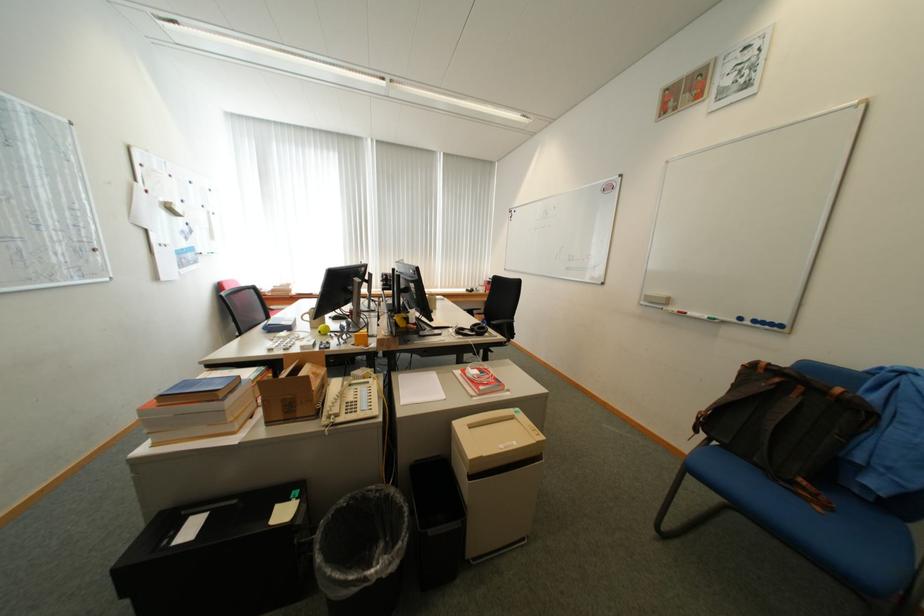
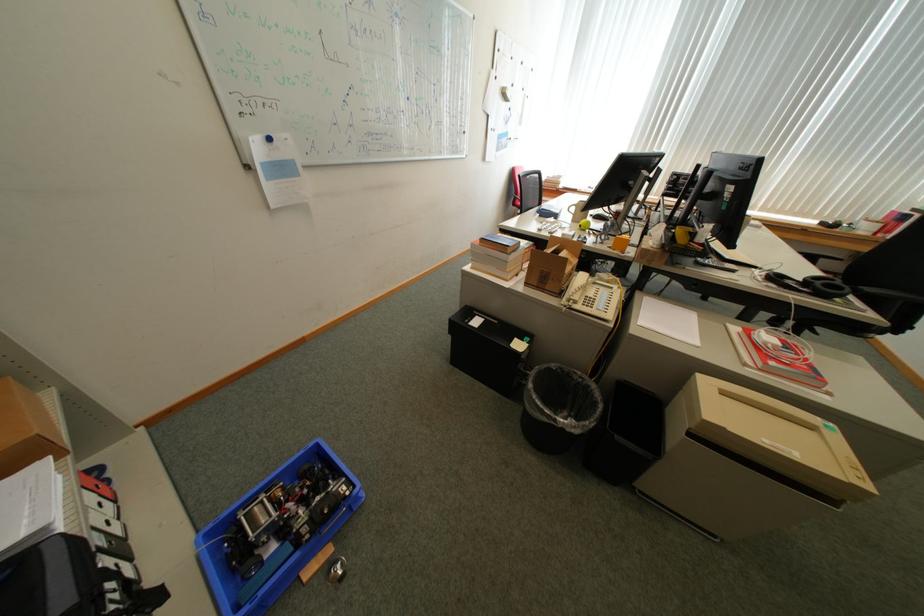
Find the pixel in the second image that matches pixel 382 572 in the first image.

(572, 421)